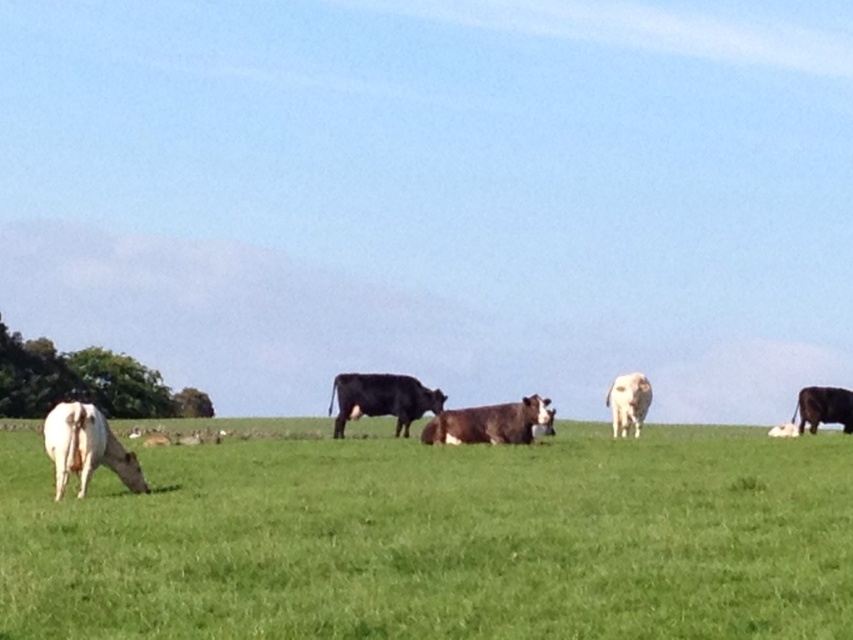
How much distance is there between white smooth cow at lower left and white smooth cow at left?

white smooth cow at lower left is 4.27 meters away from white smooth cow at left.

Can you confirm if white smooth cow at lower left is thinner than white smooth cow at left?

In fact, white smooth cow at lower left might be wider than white smooth cow at left.

In the scene shown: Who is more distant from viewer, (x=212, y=616) or (x=108, y=445)?

Positioned behind is point (x=108, y=445).

Where is `white smooth cow at lower left`? white smooth cow at lower left is located at coordinates (439, 540).

In the scene shown: How far apart are white smooth cow at left and brown smooth cow at center?

They are 9.00 meters apart.

Is white smooth cow at left thinner than brown smooth cow at center?

Yes, white smooth cow at left is thinner than brown smooth cow at center.

Where is `white smooth cow at left`? The height and width of the screenshot is (640, 853). white smooth cow at left is located at coordinates (86, 448).

At what (x,y) coordinates should I click in order to perform the action: click on white smooth cow at left. Please return your answer as a coordinate pair (x, y). Looking at the image, I should click on (86, 448).

Is shiny black cow at center bigger than shiny brown cow at right?

Correct, shiny black cow at center is larger in size than shiny brown cow at right.

Does shiny black cow at center appear on the right side of shiny brown cow at right?

Incorrect, shiny black cow at center is not on the right side of shiny brown cow at right.

Where is `shiny black cow at center`? This screenshot has width=853, height=640. shiny black cow at center is located at coordinates (381, 400).